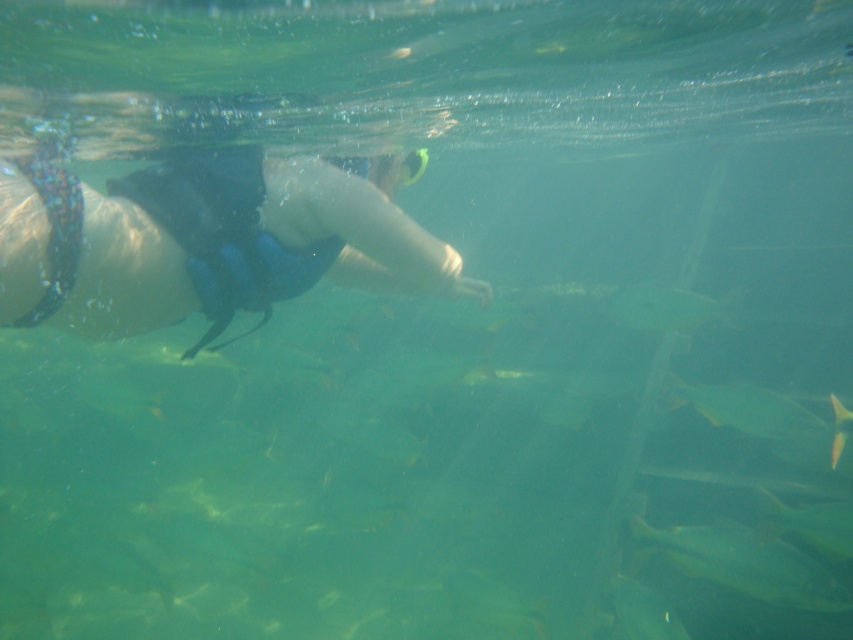
Question: Based on their relative distances, which object is nearer to the green matte fish at lower right?

Choices:
 (A) green shiny fish at center
 (B) translucent greenish-yellow fish at lower center

Answer: (B)

Question: Which of the following is the closest to the observer?

Choices:
 (A) (836, 397)
 (B) (769, 497)
 (C) (699, 554)

Answer: (C)

Question: Does green shiny fish at center appear on the right side of green matte fish at center?

Choices:
 (A) yes
 (B) no

Answer: (A)

Question: Which point is closer to the camera?

Choices:
 (A) (24, 280)
 (B) (635, 621)
 (C) (836, 413)

Answer: (A)

Question: Is blue neoprene wetsuit at center to the left of green matte fish at center from the viewer's perspective?

Choices:
 (A) no
 (B) yes

Answer: (B)

Question: Is green matte fish at lower right closer to the viewer compared to translucent greenish-yellow fish at lower center?

Choices:
 (A) yes
 (B) no

Answer: (A)